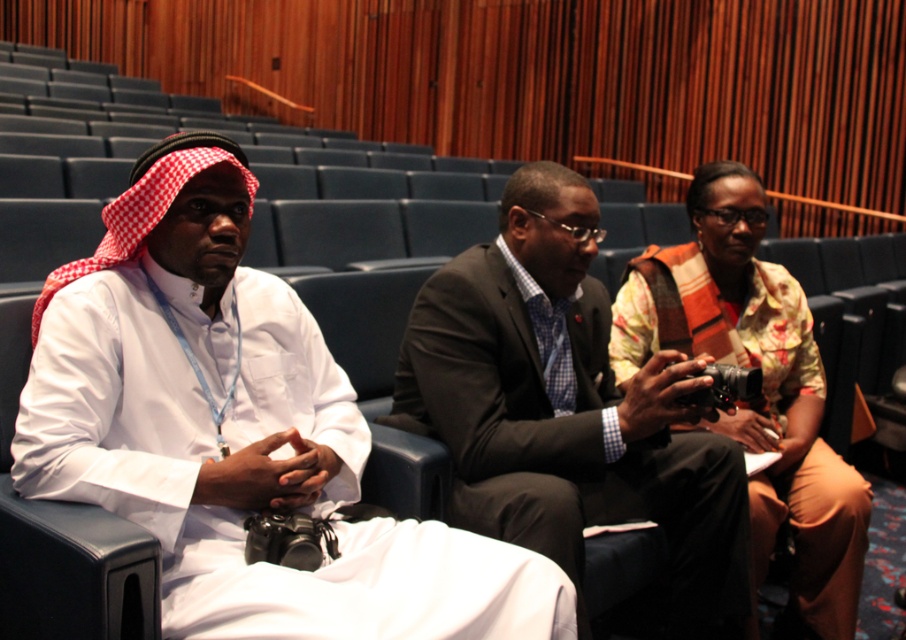
Does point (226, 628) lie in front of point (605, 412)?

Yes.

Which of these two, white cloth at left or dark brown suit at center, stands shorter?

Standing shorter between the two is white cloth at left.

You are a GUI agent. You are given a task and a screenshot of the screen. Output one action in this format:
    pyautogui.click(x=<x>, y=<y>)
    Task: Click on the white cloth at left
    
    Given the screenshot: What is the action you would take?
    pyautogui.click(x=237, y=429)

Does white cloth at left appear on the left side of floral cotton robe at center?

Yes, white cloth at left is to the left of floral cotton robe at center.

Which is in front, point (49, 490) or point (822, 396)?

Point (49, 490) is in front.

What do you see at coordinates (237, 429) in the screenshot? The image size is (906, 640). I see `white cloth at left` at bounding box center [237, 429].

Image resolution: width=906 pixels, height=640 pixels. I want to click on white cloth at left, so click(237, 429).

Does dark brown suit at center have a lesser width compared to floral cotton robe at center?

Incorrect, dark brown suit at center's width is not less than floral cotton robe at center's.

Is the position of dark brown suit at center more distant than that of floral cotton robe at center?

That is False.

Describe the element at coordinates (566, 408) in the screenshot. I see `dark brown suit at center` at that location.

Locate an element on the screen. Image resolution: width=906 pixels, height=640 pixels. dark brown suit at center is located at coordinates [566, 408].